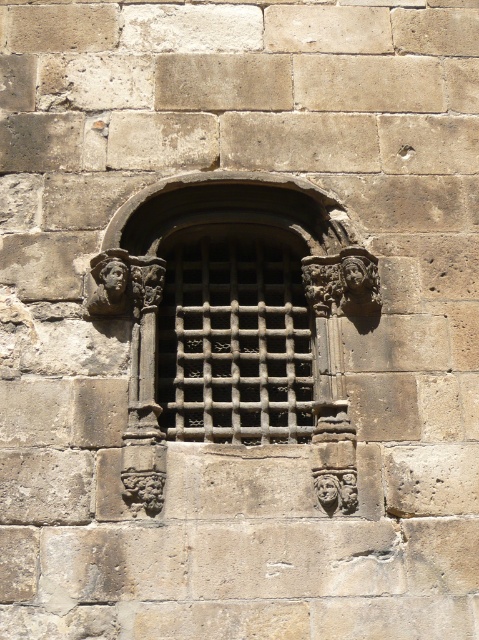
Between point (145, 426) and point (120, 266), which one is positioned behind?

The point (120, 266) is more distant.

Image resolution: width=479 pixels, height=640 pixels. What are the coordinates of `wooden lattice window at center` in the screenshot? It's located at coord(238,308).

Identify the location of wooden lattice window at center. This screenshot has height=640, width=479. (238, 308).